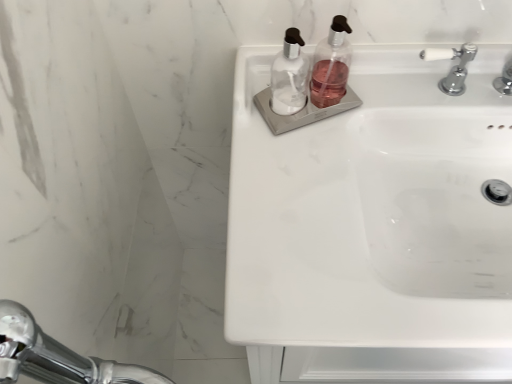
This screenshot has height=384, width=512. In order to click on free location in front of transparent plastic soap dispenser at center, which is the 1th soap dispenser from left to right in this screenshot , I will do `click(291, 179)`.